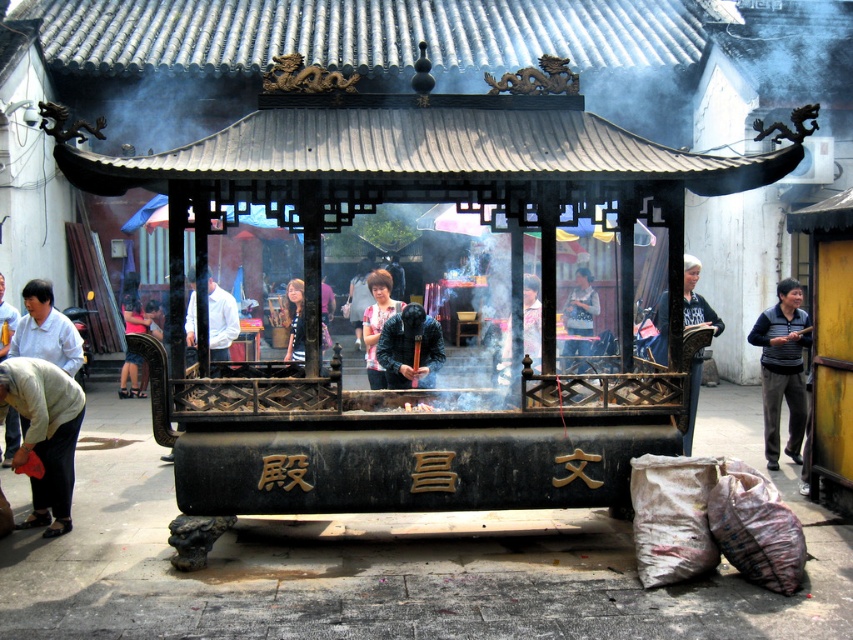
Image resolution: width=853 pixels, height=640 pixels. What do you see at coordinates (45, 435) in the screenshot?
I see `light beige fabric pants at lower left` at bounding box center [45, 435].

Is light beige fabric pants at lower left positioned at the back of gray sweater at right?

That is False.

The width and height of the screenshot is (853, 640). What do you see at coordinates (45, 435) in the screenshot?
I see `light beige fabric pants at lower left` at bounding box center [45, 435].

You are a GUI agent. You are given a task and a screenshot of the screen. Output one action in this format:
    pyautogui.click(x=<x>, y=<y>)
    Task: Click on the light beige fabric pants at lower left
    
    Given the screenshot: What is the action you would take?
    click(x=45, y=435)

Between light beige fabric pants at lower left and white shirt at center, which one appears on the right side from the viewer's perspective?

From the viewer's perspective, white shirt at center appears more on the right side.

Does light beige fabric pants at lower left come in front of white shirt at center?

Yes, light beige fabric pants at lower left is closer to the viewer.

What do you see at coordinates (45, 435) in the screenshot?
I see `light beige fabric pants at lower left` at bounding box center [45, 435].

Identify the location of light beige fabric pants at lower left. The image size is (853, 640). (45, 435).

Does light beige fabric pants at lower left appear under striped shirt at center?

Correct, light beige fabric pants at lower left is located below striped shirt at center.

Between light beige fabric pants at lower left and striped shirt at center, which one is positioned lower?

light beige fabric pants at lower left

The image size is (853, 640). What do you see at coordinates (45, 435) in the screenshot?
I see `light beige fabric pants at lower left` at bounding box center [45, 435].

This screenshot has height=640, width=853. Find the location of `light beige fabric pants at lower left`. light beige fabric pants at lower left is located at coordinates (45, 435).